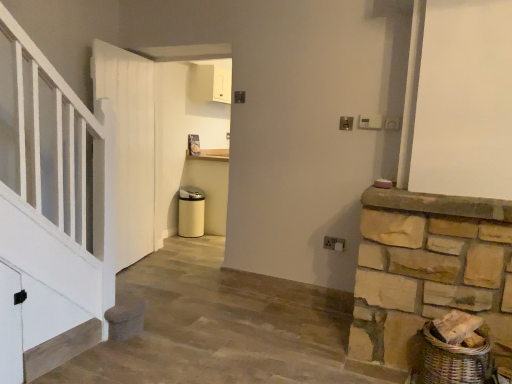
Question: Considering the relative positions of natural stone mantle at right and white wooden door at left in the image provided, is natural stone mantle at right behind white wooden door at left?

Choices:
 (A) no
 (B) yes

Answer: (A)

Question: Considering the relative sizes of natural stone mantle at right and white wooden door at left in the image provided, is natural stone mantle at right taller than white wooden door at left?

Choices:
 (A) yes
 (B) no

Answer: (B)

Question: Is natural stone mantle at right directly adjacent to white wooden door at left?

Choices:
 (A) no
 (B) yes

Answer: (A)

Question: Can white wooden door at left be found inside natural stone mantle at right?

Choices:
 (A) yes
 (B) no

Answer: (B)

Question: From a real-world perspective, is natural stone mantle at right beneath white wooden door at left?

Choices:
 (A) yes
 (B) no

Answer: (A)

Question: Is natural stone mantle at right smaller than white wooden door at left?

Choices:
 (A) yes
 (B) no

Answer: (A)

Question: Is white wooden door at left in front of natural stone mantle at right?

Choices:
 (A) no
 (B) yes

Answer: (A)

Question: Are white wooden door at left and natural stone mantle at right making contact?

Choices:
 (A) yes
 (B) no

Answer: (B)

Question: Can you confirm if white wooden door at left is thinner than natural stone mantle at right?

Choices:
 (A) yes
 (B) no

Answer: (A)

Question: From the image's perspective, is white wooden door at left on natural stone mantle at right?

Choices:
 (A) no
 (B) yes

Answer: (B)

Question: From the image's perspective, is white wooden door at left below natural stone mantle at right?

Choices:
 (A) yes
 (B) no

Answer: (B)

Question: Is white wooden door at left positioned behind natural stone mantle at right?

Choices:
 (A) no
 (B) yes

Answer: (B)

Question: Based on their sizes in the image, would you say natural stone mantle at right is bigger or smaller than white wooden door at left?

Choices:
 (A) small
 (B) big

Answer: (A)